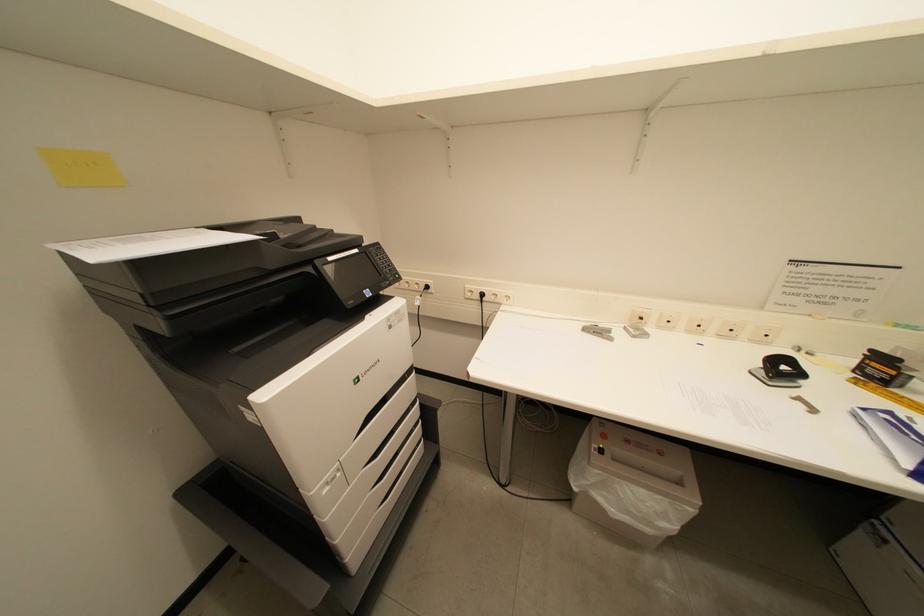
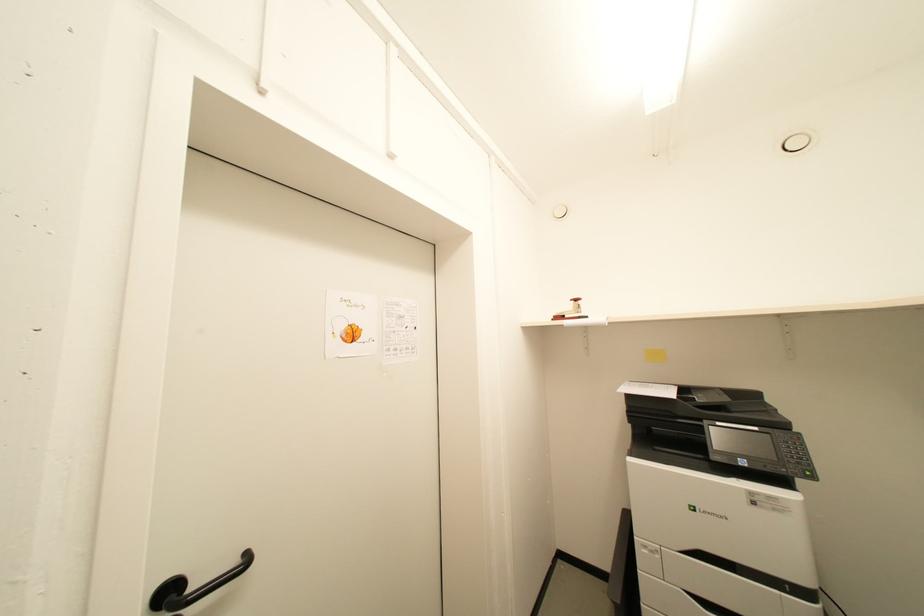
Question: The camera is either moving clockwise (left) or counter-clockwise (right) around the object. The first image is from the beginning of the video and the second image is from the end. Is the camera moving left or right when shooting the video?

Choices:
 (A) Left
 (B) Right

Answer: (B)